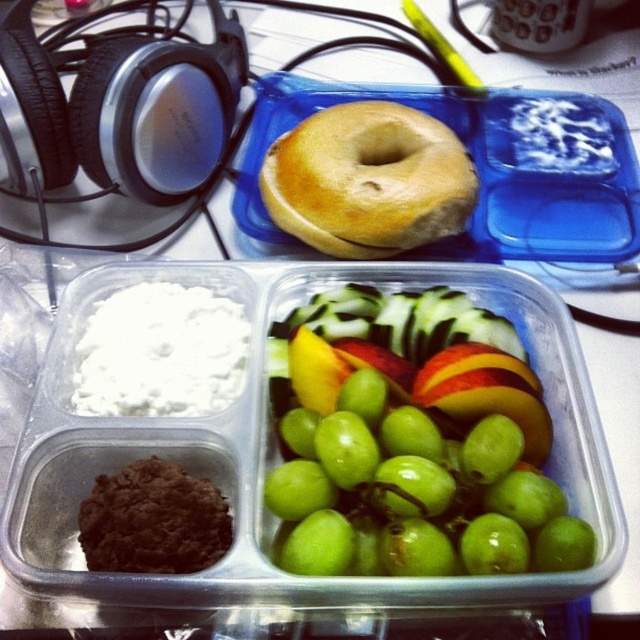
Question: Is green matte grapes at center behind golden brown bagel at center?

Choices:
 (A) yes
 (B) no

Answer: (B)

Question: Which point is closer to the camera?

Choices:
 (A) (380, 554)
 (B) (372, 161)

Answer: (A)

Question: Can you confirm if green matte grapes at center is positioned below golden brown bagel at center?

Choices:
 (A) no
 (B) yes

Answer: (B)

Question: Which point is closer to the camera taking this photo?

Choices:
 (A) (424, 227)
 (B) (451, 486)

Answer: (B)

Question: Can you confirm if green matte grapes at center is positioned to the left of golden brown bagel at center?

Choices:
 (A) no
 (B) yes

Answer: (A)